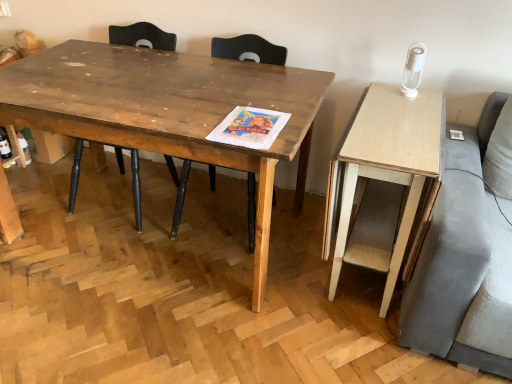
Question: Is wooden table at center inside wooden chair at center, which appears as the second chair when viewed from the right?

Choices:
 (A) yes
 (B) no

Answer: (B)

Question: From a real-world perspective, is wooden chair at center, which appears as the second chair when viewed from the right, on wooden table at center?

Choices:
 (A) yes
 (B) no

Answer: (A)

Question: Does wooden chair at center, marked as the 1th chair in a left-to-right arrangement, have a greater height compared to wooden table at center?

Choices:
 (A) yes
 (B) no

Answer: (A)

Question: From a real-world perspective, is wooden chair at center, which appears as the second chair when viewed from the right, physically below wooden table at center?

Choices:
 (A) no
 (B) yes

Answer: (A)

Question: From the image's perspective, would you say wooden chair at center, which appears as the second chair when viewed from the right, is shown under wooden table at center?

Choices:
 (A) no
 (B) yes

Answer: (A)

Question: Does wooden chair at center, marked as the 1th chair in a left-to-right arrangement, have a lesser height compared to wooden table at center?

Choices:
 (A) yes
 (B) no

Answer: (B)

Question: Can you confirm if wooden chair at center, marked as the first chair in a right-to-left arrangement, is thinner than wooden table at center?

Choices:
 (A) yes
 (B) no

Answer: (A)

Question: Can you confirm if wooden chair at center, arranged as the 2th chair when viewed from the left, is positioned to the right of wooden table at center?

Choices:
 (A) yes
 (B) no

Answer: (A)

Question: Is wooden chair at center, marked as the first chair in a right-to-left arrangement, wider than wooden table at center?

Choices:
 (A) yes
 (B) no

Answer: (B)

Question: From the image's perspective, does wooden chair at center, arranged as the 2th chair when viewed from the left, appear higher than wooden table at center?

Choices:
 (A) no
 (B) yes

Answer: (B)

Question: Does wooden chair at center, arranged as the 2th chair when viewed from the left, have a greater height compared to wooden table at center?

Choices:
 (A) no
 (B) yes

Answer: (B)

Question: Would you say wooden table at center is part of wooden chair at center, arranged as the 2th chair when viewed from the left,'s contents?

Choices:
 (A) no
 (B) yes

Answer: (A)

Question: From a real-world perspective, is wooden table at center below wooden chair at center, marked as the 1th chair in a left-to-right arrangement?

Choices:
 (A) yes
 (B) no

Answer: (A)